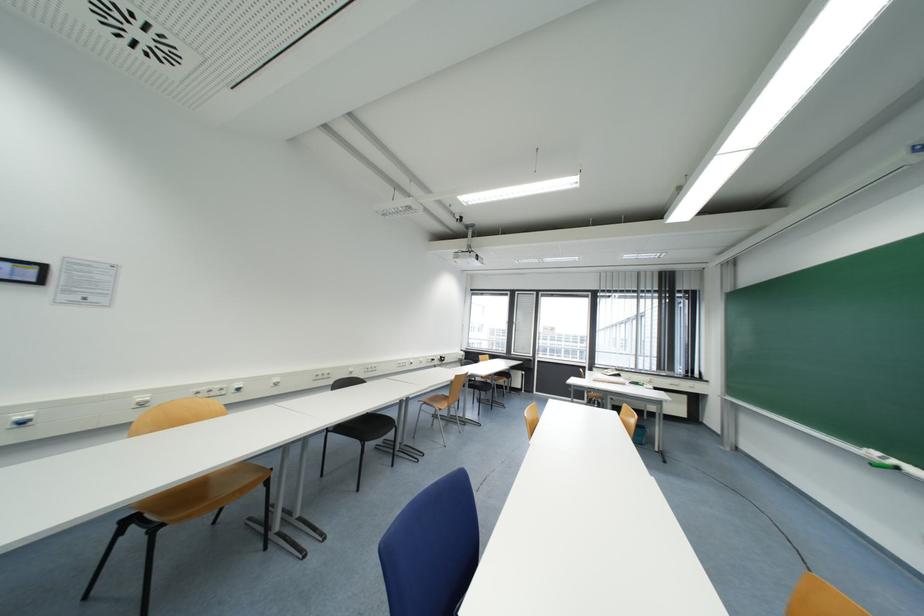
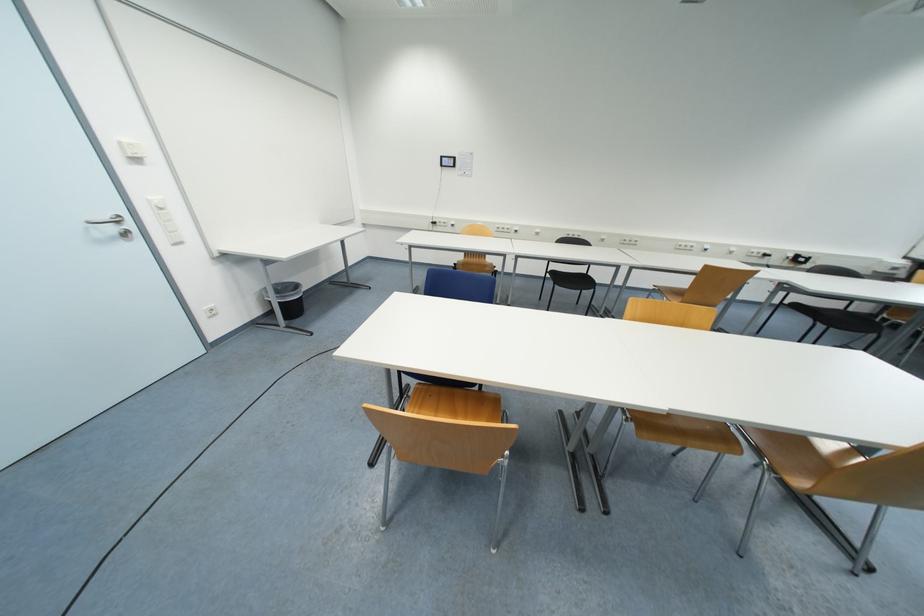
In the second image, find the point that corresponds to (281,386) in the first image.

(541, 236)